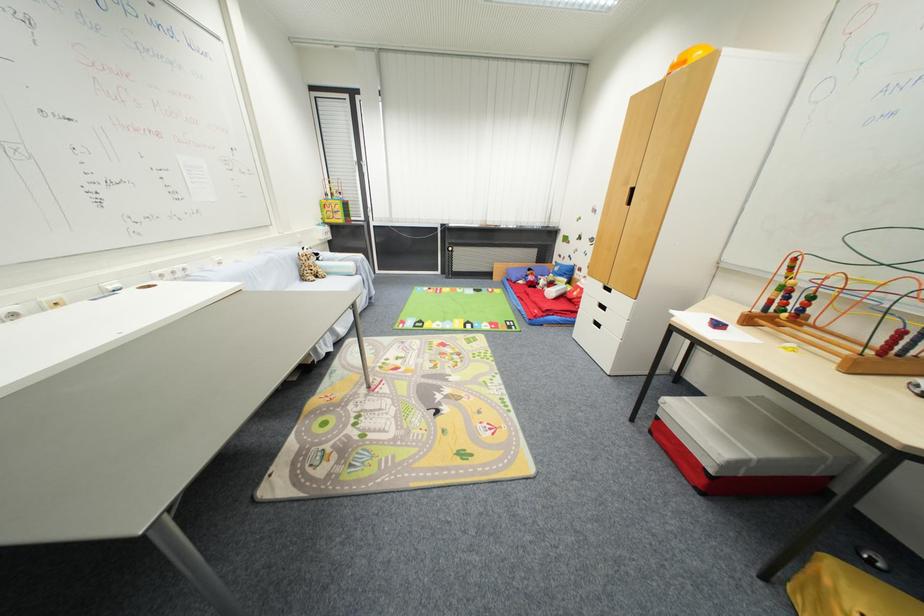
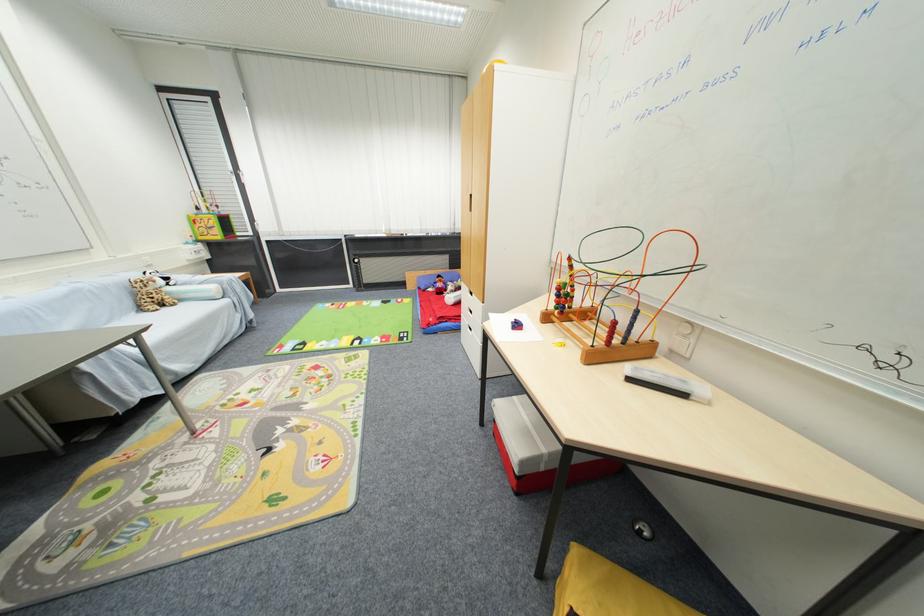
In the second image, find the point that corresponds to point (323, 282) in the first image.

(171, 310)